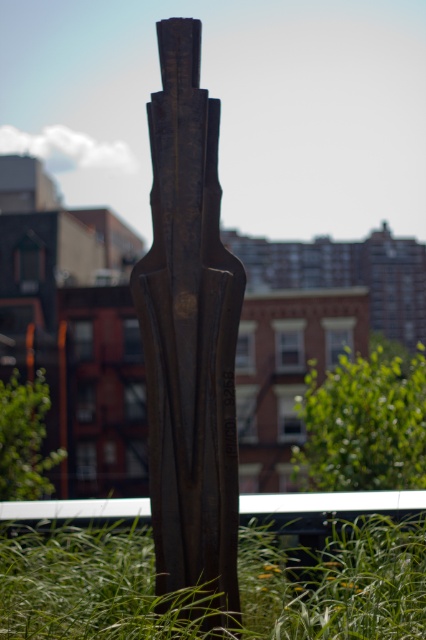
You are a maintenance worker tasked with mowing the green grass at center. You need to know if the rusty metal sculpture at center is in the way of the grass. Can you determine if the sculpture is blocking the grass?

The rusty metal sculpture at center is located above green grass at center, so it is blocking the grass. You will need to work around it to mow the grass properly.

You are standing in front of the sculpture and want to take a photo that includes both the green leafy plant at center and the green grass at lower left. Which object should you focus on first to ensure both are in clear view?

You should focus on the green leafy plant at center first because it is closer to you than the green grass at lower left, ensuring both are in focus when using a camera with a fixed focal point.